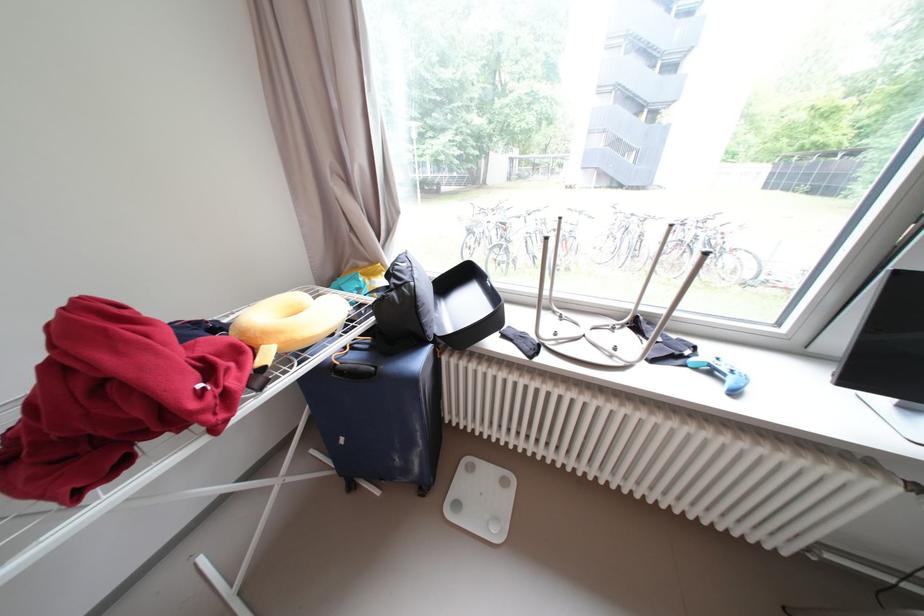
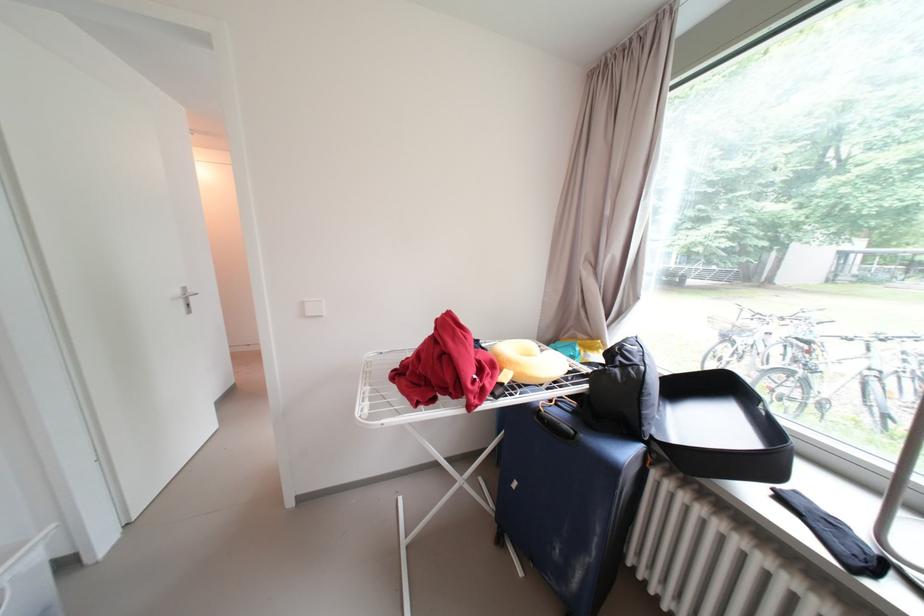
Where in the second image is the point corresponding to (x=344, y=366) from the first image?

(549, 411)